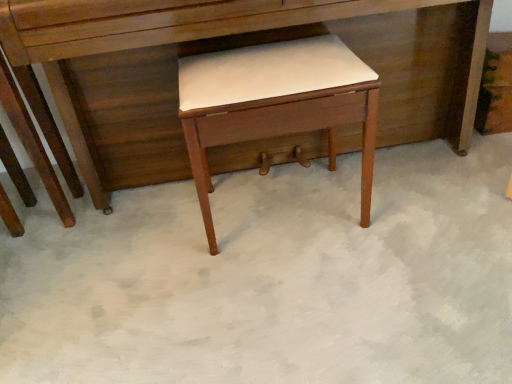
I want to click on vacant space to the right of matte wood stool at center, so click(x=410, y=203).